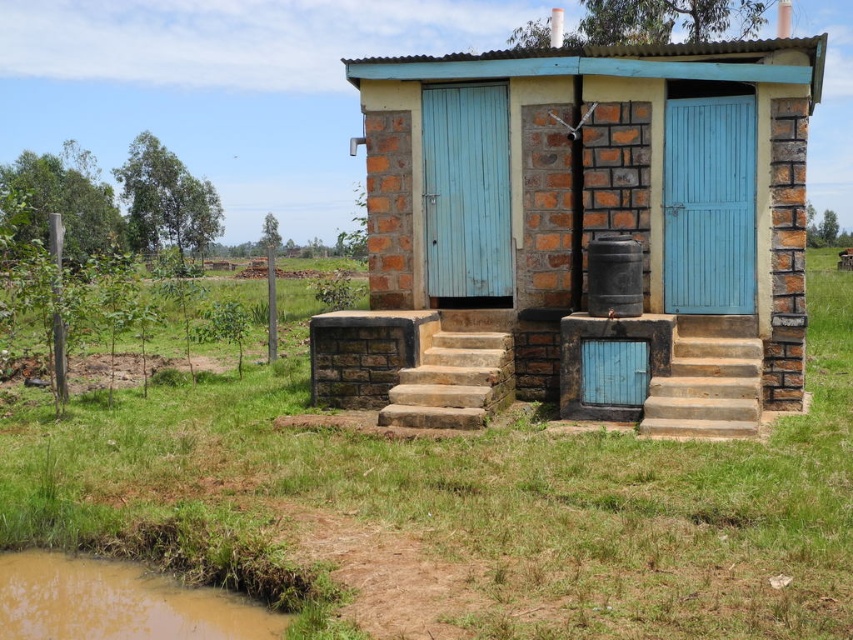
You are standing in front of the restroom and want to place a small potted plant exactly where the green grass at center is located. What are the coordinates where you should place it?

The green grass at center is located at coordinates point (x=482, y=502), so you should place the potted plant there.

What is located at the point with coordinates [482,502] in the image?

The point [482,502] is where the green grass at center is located.

You are a maintenance worker inspecting the public restroom. You need to replace the smaller set of stairs. Which stairs should you choose between the brown stone stairs at right and the brown stone stairs at center?

The brown stone stairs at center is the smaller one, so you should choose the brown stone stairs at center to replace.